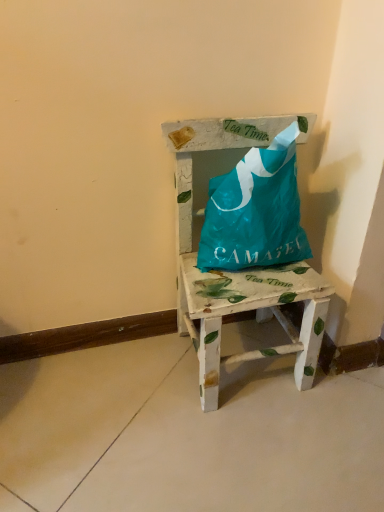
What do you see at coordinates (238, 272) in the screenshot? This screenshot has height=512, width=384. I see `painted wood chair at center` at bounding box center [238, 272].

Image resolution: width=384 pixels, height=512 pixels. I want to click on painted wood chair at center, so click(x=238, y=272).

Measure the distance between point [299,290] and camera.

The depth of point [299,290] is 71.70 centimeters.

Where is `teal plastic bag at center`? The height and width of the screenshot is (512, 384). teal plastic bag at center is located at coordinates (255, 211).

What do you see at coordinates (255, 211) in the screenshot?
I see `teal plastic bag at center` at bounding box center [255, 211].

What are the coordinates of `painted wood chair at center` in the screenshot? It's located at (238, 272).

Is teal plastic bag at center to the right of painted wood chair at center from the viewer's perspective?

Indeed, teal plastic bag at center is positioned on the right side of painted wood chair at center.

Relative to painted wood chair at center, is teal plastic bag at center in front or behind?

teal plastic bag at center is positioned farther from the viewer than painted wood chair at center.

Which is closer to the camera, (303,251) or (166,137)?

Point (303,251) is positioned farther from the camera compared to point (166,137).

From the image's perspective, is teal plastic bag at center below painted wood chair at center?

No.

From a real-world perspective, which object rests below the other?

In real-world perspective, painted wood chair at center is lower.

Can you confirm if teal plastic bag at center is wider than painted wood chair at center?

No, teal plastic bag at center is not wider than painted wood chair at center.

Between teal plastic bag at center and painted wood chair at center, which one has more height?

painted wood chair at center.

Is teal plastic bag at center smaller than painted wood chair at center?

Indeed, teal plastic bag at center has a smaller size compared to painted wood chair at center.

Is teal plastic bag at center located outside painted wood chair at center?

Actually, teal plastic bag at center is within painted wood chair at center.

Based on the photo, is teal plastic bag at center beside painted wood chair at center?

Yes, the surface of teal plastic bag at center is in contact with painted wood chair at center.

Is teal plastic bag at center facing away from painted wood chair at center?

Yes, teal plastic bag at center is facing away from painted wood chair at center.

Identify the location of furniture that appears on the left of teal plastic bag at center. The image size is (384, 512). (238, 272).

Does painted wood chair at center appear on the right side of teal plastic bag at center?

Incorrect, painted wood chair at center is not on the right side of teal plastic bag at center.

Which is in front, painted wood chair at center or teal plastic bag at center?

painted wood chair at center is in front.

Between point (193, 264) and point (256, 190), which one is positioned behind?

Point (193, 264)

Looking at this image, from the image's perspective, would you say painted wood chair at center is positioned over teal plastic bag at center?

Actually, painted wood chair at center appears below teal plastic bag at center in the image.

From a real-world perspective, which is physically above, painted wood chair at center or teal plastic bag at center?

In real-world perspective, teal plastic bag at center is above.

Considering the sizes of objects painted wood chair at center and teal plastic bag at center in the image provided, who is thinner, painted wood chair at center or teal plastic bag at center?

With smaller width is teal plastic bag at center.

From the picture: Does painted wood chair at center have a lesser height compared to teal plastic bag at center?

No.

Considering the relative sizes of painted wood chair at center and teal plastic bag at center in the image provided, is painted wood chair at center smaller than teal plastic bag at center?

No, painted wood chair at center is not smaller than teal plastic bag at center.

Could teal plastic bag at center be considered to be inside painted wood chair at center?

Yes, teal plastic bag at center is a part of painted wood chair at center.

Is painted wood chair at center with teal plastic bag at center?

Yes.

Does painted wood chair at center turn towards teal plastic bag at center?

Yes, painted wood chair at center is aimed at teal plastic bag at center.

How many degrees apart are the facing directions of painted wood chair at center and teal plastic bag at center?

0.000487 degrees separate the facing orientations of painted wood chair at center and teal plastic bag at center.

This screenshot has height=512, width=384. Find the location of `furniture on the left side of teal plastic bag at center`. furniture on the left side of teal plastic bag at center is located at coordinates (238, 272).

I want to click on furniture in front of the teal plastic bag at center, so (x=238, y=272).

You are a GUI agent. You are given a task and a screenshot of the screen. Output one action in this format:
    pyautogui.click(x=<x>, y=<y>)
    Task: Click on the furniture that is on the left side of teal plastic bag at center
    Image resolution: width=384 pixels, height=512 pixels.
    Given the screenshot: What is the action you would take?
    pyautogui.click(x=238, y=272)